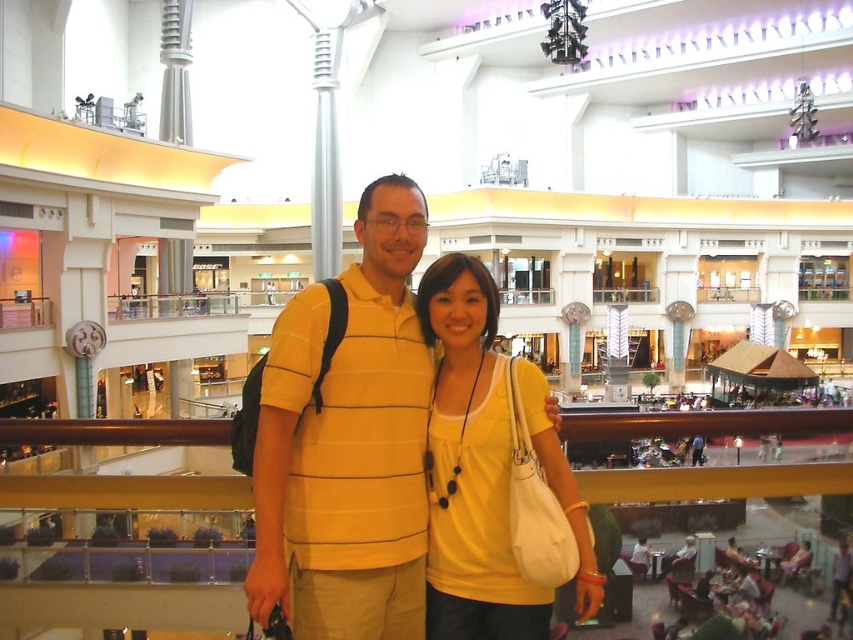
Question: Is yellow striped polo shirt at center thinner than yellow matte tank top at center?

Choices:
 (A) yes
 (B) no

Answer: (B)

Question: Does yellow striped polo shirt at center have a smaller size compared to yellow matte tank top at center?

Choices:
 (A) yes
 (B) no

Answer: (B)

Question: Is yellow striped polo shirt at center thinner than yellow matte tank top at center?

Choices:
 (A) yes
 (B) no

Answer: (B)

Question: Which point appears closest to the camera in this image?

Choices:
 (A) (386, 589)
 (B) (471, 627)

Answer: (A)